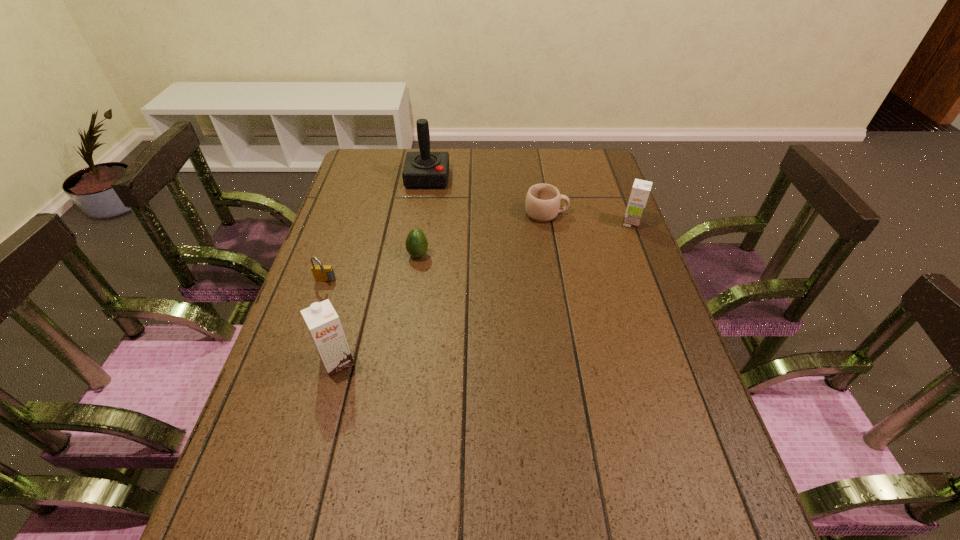
The width and height of the screenshot is (960, 540). I want to click on the taller chocolate milk, so click(x=323, y=323).

You are a GUI agent. You are given a task and a screenshot of the screen. Output one action in this format:
    pyautogui.click(x=<x>, y=<y>)
    Task: Click on the fifth shortest object
    This screenshot has height=540, width=960.
    Given the screenshot: What is the action you would take?
    pyautogui.click(x=323, y=323)

What are the coordinates of `the rightmost object` in the screenshot? It's located at (639, 195).

The height and width of the screenshot is (540, 960). What are the coordinates of `the shorter chocolate milk` in the screenshot? It's located at (639, 195).

Find the location of a particular element. This screenshot has height=540, width=960. joystick is located at coordinates (424, 169).

This screenshot has width=960, height=540. Find the location of `mug`. mug is located at coordinates (542, 205).

The width and height of the screenshot is (960, 540). I want to click on the fifth farthest object, so click(324, 273).

Find the location of a particular element. The image size is (960, 540). the leftmost object is located at coordinates (324, 273).

Locate an element on the screen. This screenshot has height=540, width=960. the fourth farthest object is located at coordinates (416, 243).

This screenshot has height=540, width=960. What are the coordinates of `free space located on the right of the nearer chocolate milk` in the screenshot? It's located at (452, 362).